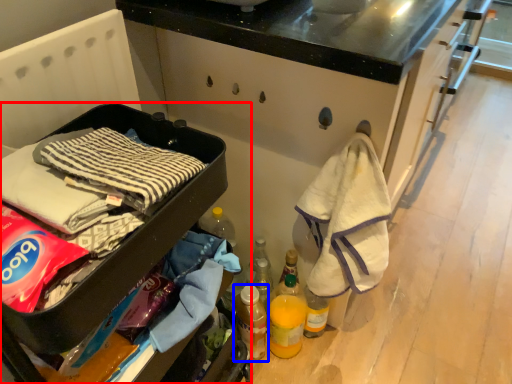
Question: Which object appears farthest to the camera in this image, furniture (highlighted by a red box) or bottle (highlighted by a blue box)?

Choices:
 (A) furniture
 (B) bottle

Answer: (B)